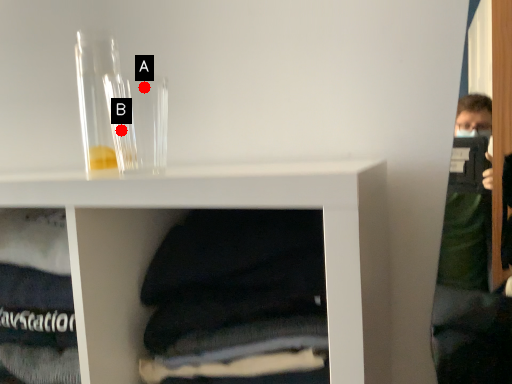
Question: Two points are circled on the image, labeled by A and B beside each circle. Which of the following is the farthest from the observer?

Choices:
 (A) A is further
 (B) B is further

Answer: (B)